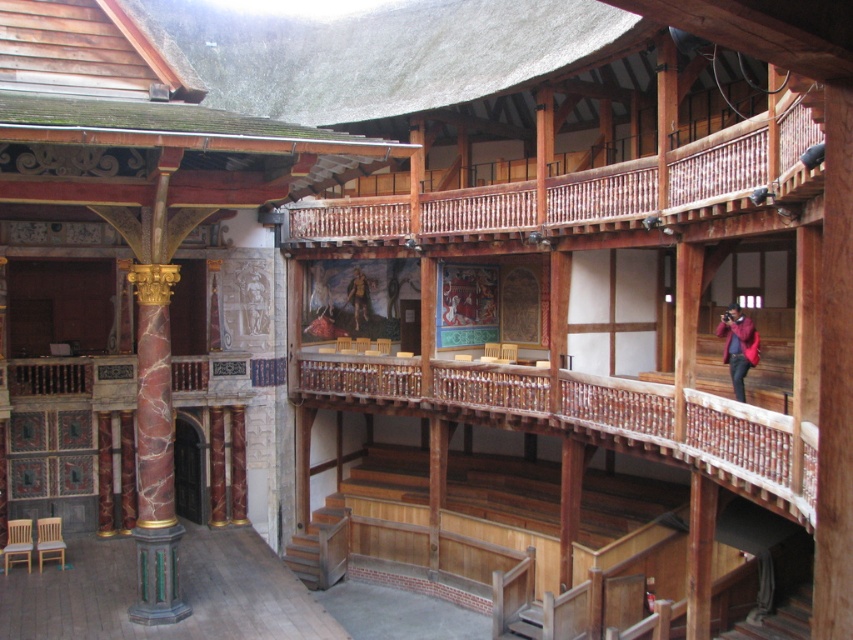
Which of these two, wooden stairs at lower center or brown leather armor at center, stands shorter?

Standing shorter between the two is wooden stairs at lower center.

Identify the location of wooden stairs at lower center. (321, 545).

Does point (292, 236) come behind point (735, 353)?

Yes, it is.

Does wooden railing at upper right lie behind red velvet coat at upper right?

No, wooden railing at upper right is closer to the viewer.

Does point (473, 237) come in front of point (730, 339)?

No.

Locate an element on the screen. Image resolution: width=853 pixels, height=640 pixels. wooden railing at upper right is located at coordinates (689, 177).

Between wooden railing at upper right and wooden stairs at lower center, which one has less height?

wooden railing at upper right

Identify the location of wooden railing at upper right. Image resolution: width=853 pixels, height=640 pixels. (689, 177).

Does point (630, 170) lie behind point (314, 513)?

No, it is in front of (314, 513).

This screenshot has height=640, width=853. In order to click on wooden railing at upper right in this screenshot , I will do `click(689, 177)`.